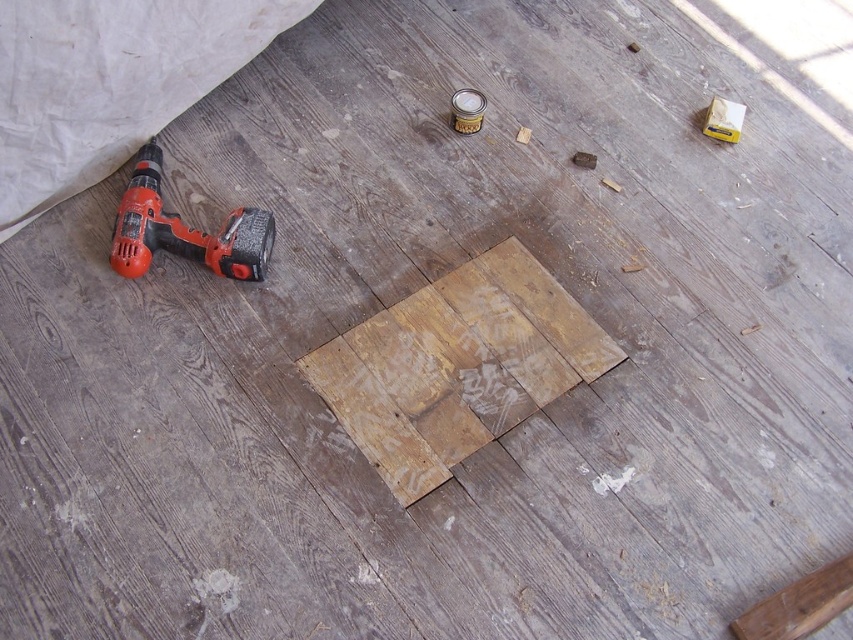
Which of these two, weathered wood plank at center or orange plastic drill at lower left, stands shorter?

With less height is orange plastic drill at lower left.

You are a GUI agent. You are given a task and a screenshot of the screen. Output one action in this format:
    pyautogui.click(x=<x>, y=<y>)
    Task: Click on the weathered wood plank at center
    This screenshot has height=640, width=853.
    Given the screenshot: What is the action you would take?
    pyautogui.click(x=456, y=365)

This screenshot has width=853, height=640. What are the coordinates of `weathered wood plank at center` in the screenshot? It's located at (456, 365).